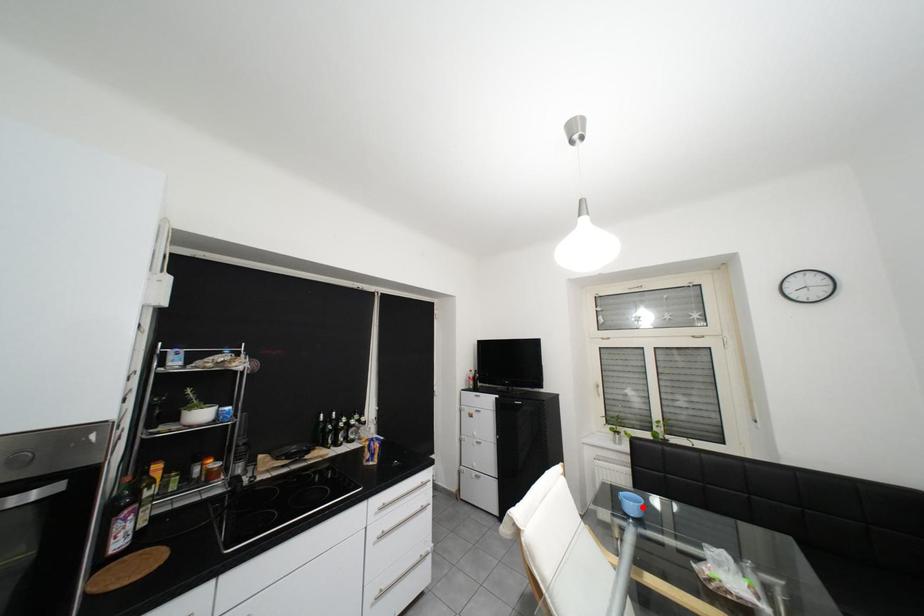
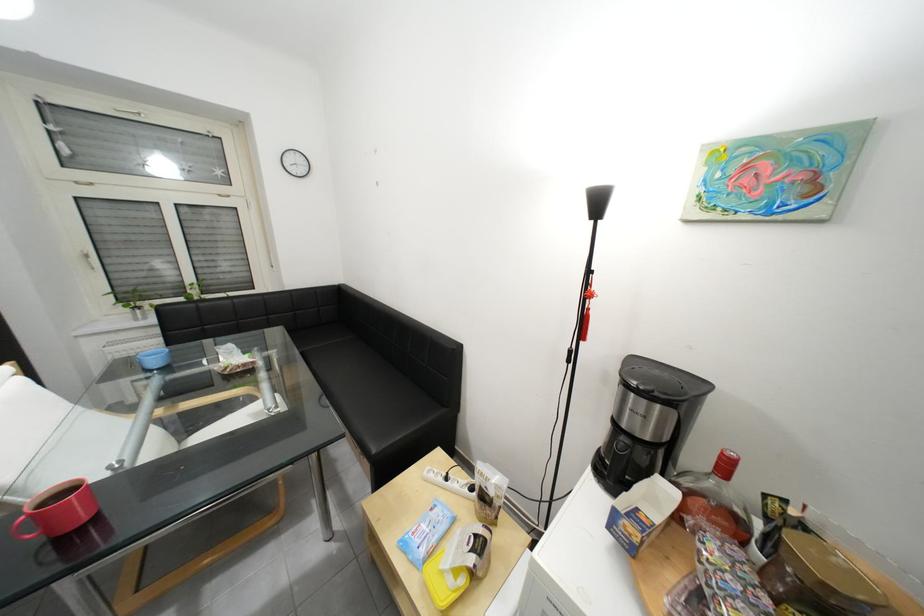
In the second image, find the point that corresponds to the highlighted location in the first image.

(166, 363)